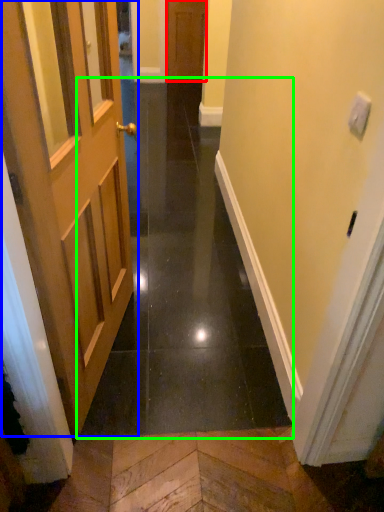
Question: Which object is the farthest from door (highlighted by a red box)? Choose among these: door (highlighted by a blue box) or path (highlighted by a green box).

Choices:
 (A) door
 (B) path

Answer: (A)